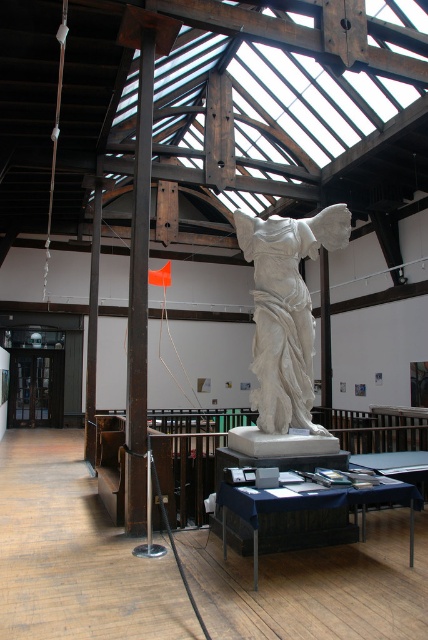
Is white marble statue at center to the right of orange fabric flag at center from the viewer's perspective?

Yes, white marble statue at center is to the right of orange fabric flag at center.

Locate an element on the screen. white marble statue at center is located at coordinates tap(285, 310).